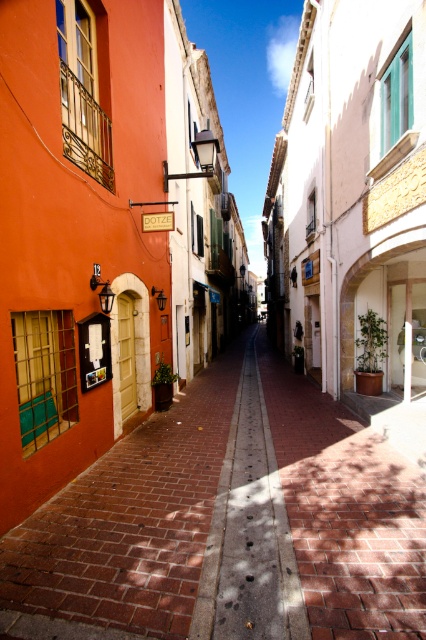
You are standing at the entrance of the orange building on the left side of the street. You want to walk to the smooth brick pavement at center. Which direction should you move in?

You should move towards the center of the street to reach the smooth brick pavement at center, as it is located at point (345,512).